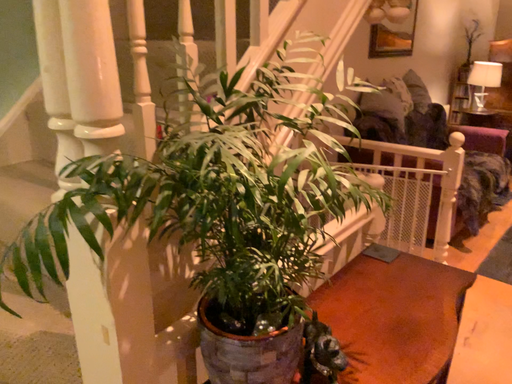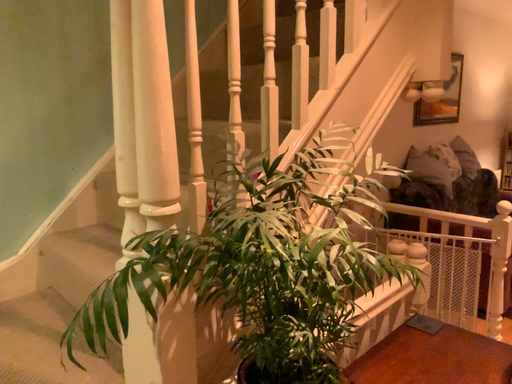
Question: Which way did the camera rotate in the video?

Choices:
 (A) rotated left
 (B) rotated right

Answer: (A)